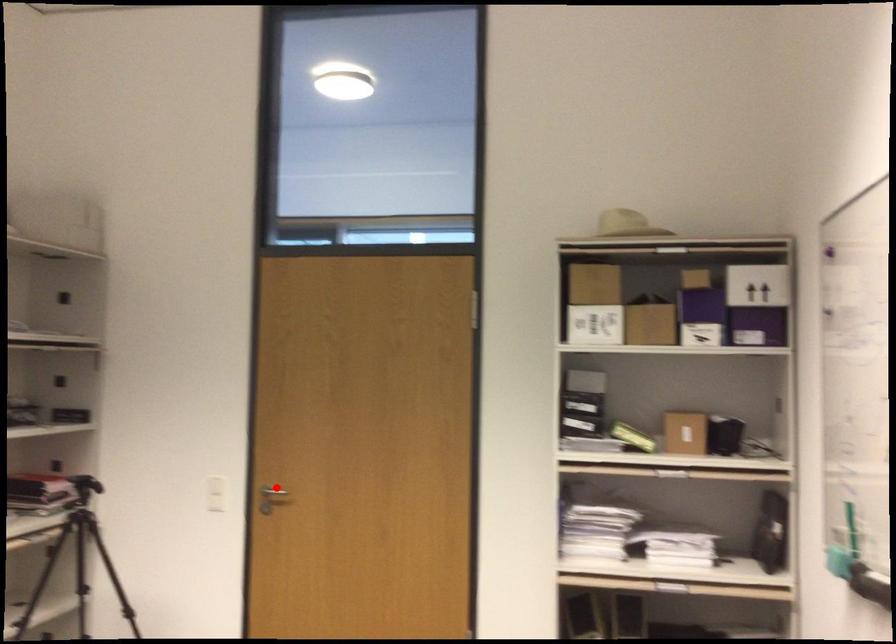
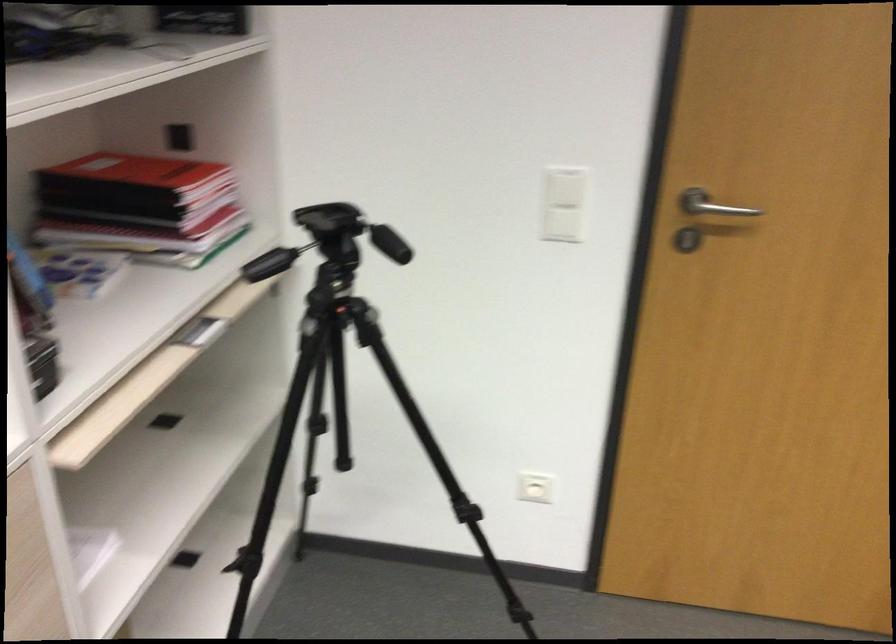
Question: I am providing you with two images of the same scene from different viewpoints. In image1, a red point is highlighted. Considering the same 3D point in image2, which of the following is correct?

Choices:
 (A) It is closer
 (B) It is farther

Answer: (A)